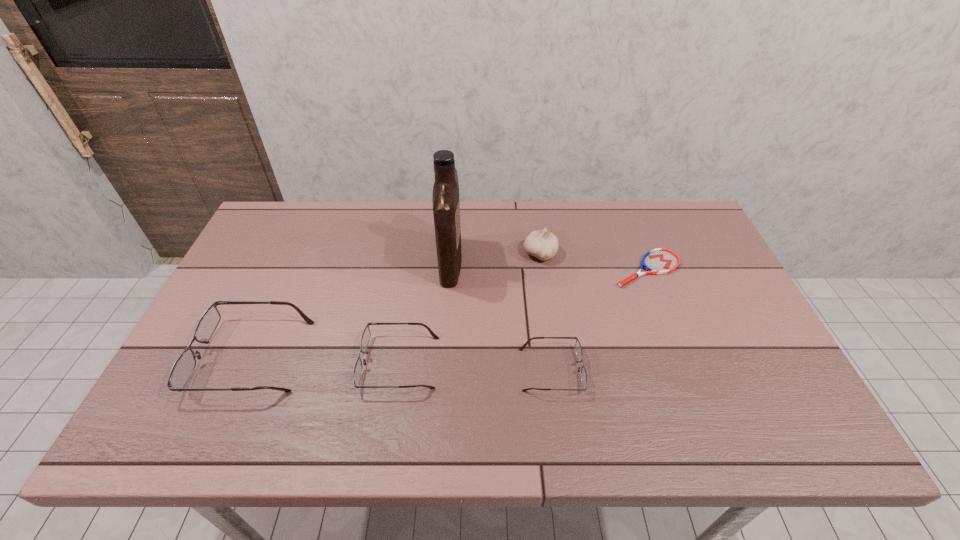
Where is `vacant space in between the rightmost spectacles and the tallest spectacles`? The height and width of the screenshot is (540, 960). vacant space in between the rightmost spectacles and the tallest spectacles is located at coordinates (401, 363).

Locate an element on the screen. The height and width of the screenshot is (540, 960). vacant region between the fifth tallest object and the tallest object is located at coordinates 501,316.

Find the location of a particular element. This screenshot has width=960, height=540. free space between the third shortest object and the liquor is located at coordinates (425, 312).

Where is `free area in between the tallest object and the tallest spectacles`? free area in between the tallest object and the tallest spectacles is located at coordinates (351, 309).

Find the location of a particular element. The width and height of the screenshot is (960, 540). free area in between the rightmost object and the third tallest object is located at coordinates pyautogui.click(x=449, y=313).

The height and width of the screenshot is (540, 960). Find the location of `free space that is in between the liquor and the second tallest object`. free space that is in between the liquor and the second tallest object is located at coordinates (495, 258).

Where is `free space between the tallest object and the rightmost object`? The width and height of the screenshot is (960, 540). free space between the tallest object and the rightmost object is located at coordinates (549, 265).

Find the location of `blank region between the second shortest object and the tallest object`. blank region between the second shortest object and the tallest object is located at coordinates (501, 316).

This screenshot has width=960, height=540. I want to click on object that is the closest one to the third shortest object, so click(184, 366).

The image size is (960, 540). I want to click on object that is the closest to the fourth shortest object, so click(365, 338).